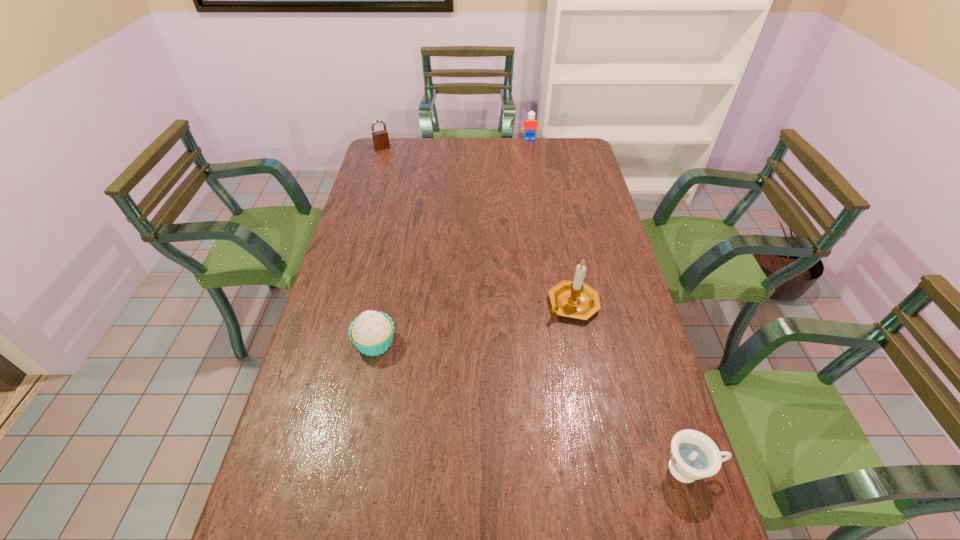
At what (x,y) coordinates should I click in order to perform the action: click on cupcake. Please return your answer as a coordinate pair (x, y). Looking at the image, I should click on (371, 332).

Where is `the fourth object from right to left`? Image resolution: width=960 pixels, height=540 pixels. the fourth object from right to left is located at coordinates (371, 332).

Locate an element on the screen. the shortest object is located at coordinates (693, 456).

The image size is (960, 540). Identify the location of the rightmost object. (693, 456).

Locate an element on the screen. the third nearest object is located at coordinates pos(575,299).

Find the location of a particular element. This screenshot has height=540, width=960. candle holder is located at coordinates (575, 299).

Where is `padlock`? padlock is located at coordinates (380, 138).

Identify the location of the fourth nearest object. The width and height of the screenshot is (960, 540). (380, 138).

Where is `the farthest object`? the farthest object is located at coordinates point(530,125).

The width and height of the screenshot is (960, 540). I want to click on free space located 0.130m on the back of the cupcake, so click(x=385, y=292).